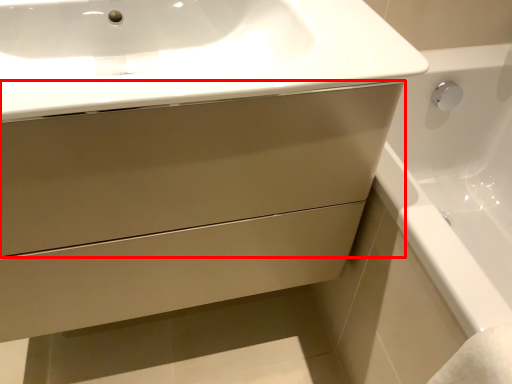
Question: In this image, where is drawer (annotated by the red box) located relative to sink?

Choices:
 (A) left
 (B) right

Answer: (A)